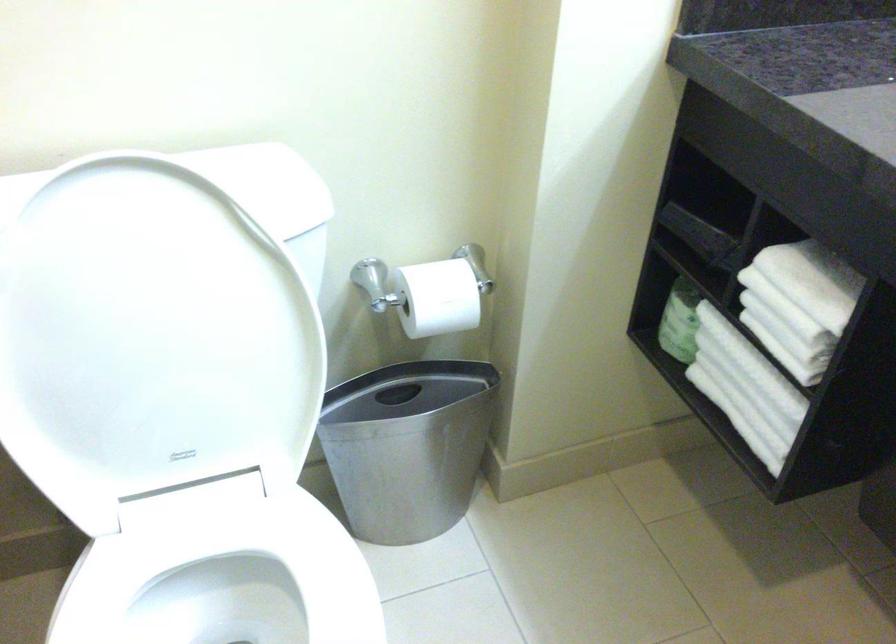
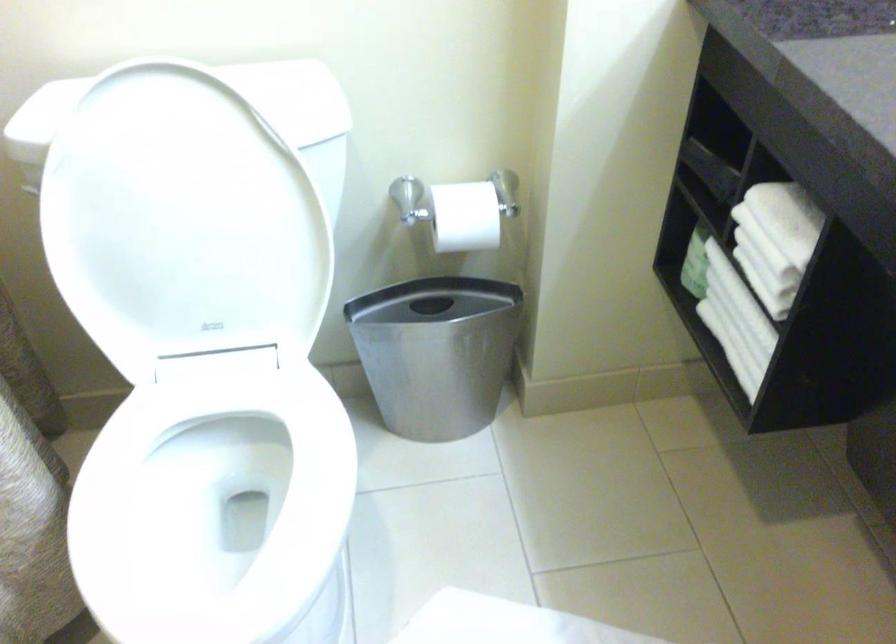
Question: The first image is from the beginning of the video and the second image is from the end. How did the camera likely rotate when shooting the video?

Choices:
 (A) Left
 (B) Right
 (C) Up
 (D) Down

Answer: (A)